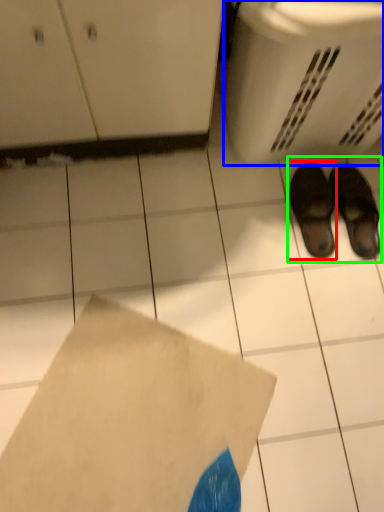
Question: Which object is the farthest from footwear (highlighted by a red box)? Choose among these: basket (highlighted by a blue box) or footwear (highlighted by a green box).

Choices:
 (A) basket
 (B) footwear

Answer: (A)